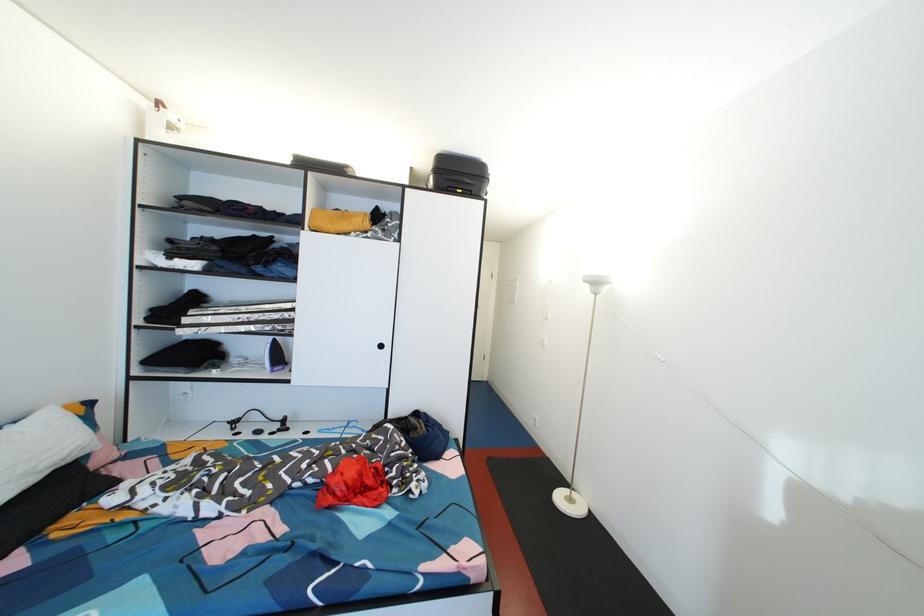
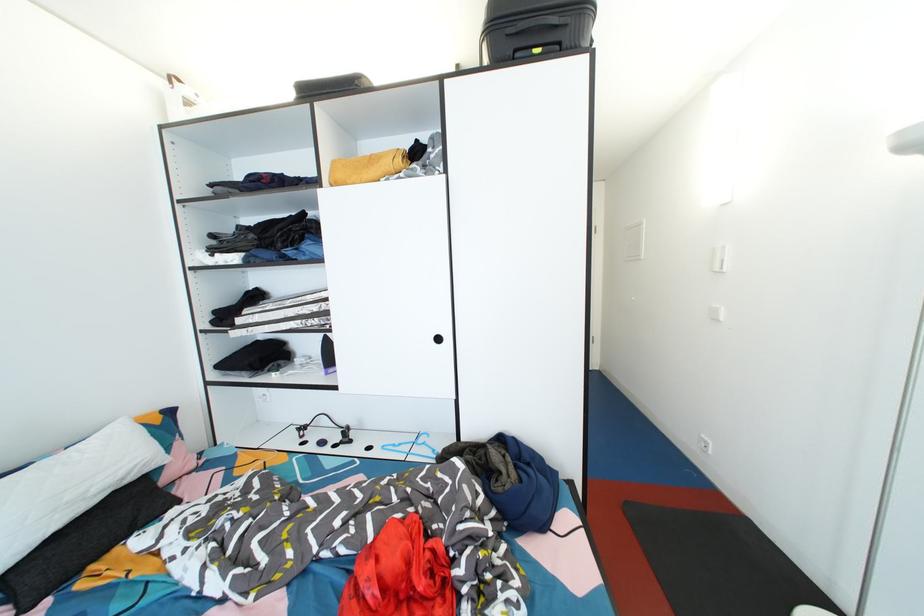
The point at (387, 351) is marked in the first image. Where is the corresponding point in the second image?

(444, 344)